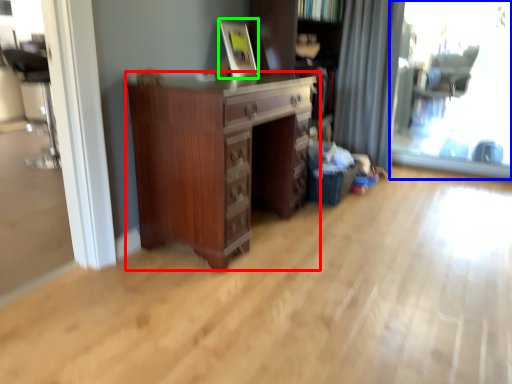
Question: Estimate the real-world distances between objects in this image. Which object is closer to chest of drawers (highlighted by a red box), window screen (highlighted by a blue box) or picture frame (highlighted by a green box)?

Choices:
 (A) window screen
 (B) picture frame

Answer: (B)